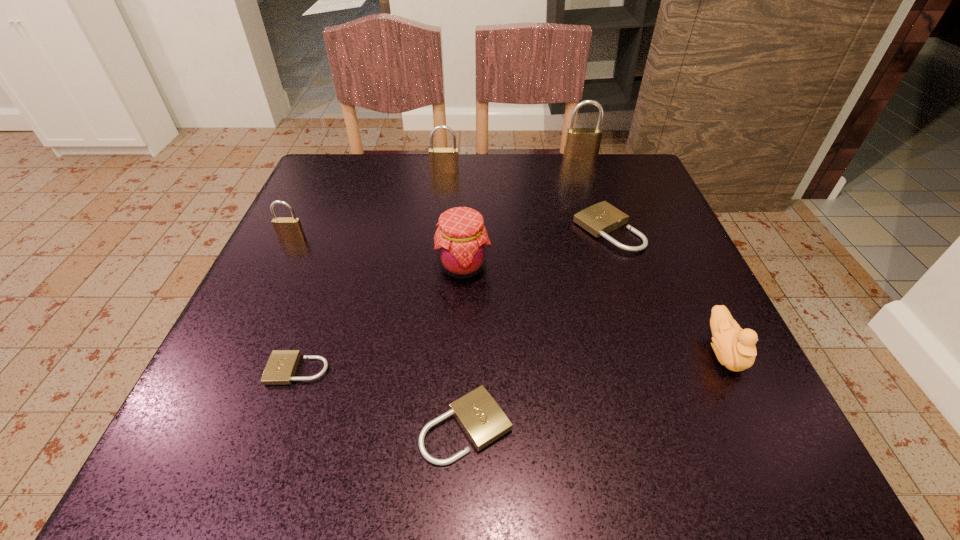
Image resolution: width=960 pixels, height=540 pixels. What are the coordinates of `the second smallest beige padlock` in the screenshot? It's located at (479, 415).

Where is `the nearest padlock`? The height and width of the screenshot is (540, 960). the nearest padlock is located at coordinates (479, 415).

You are a GUI agent. You are given a task and a screenshot of the screen. Output one action in this format:
    pyautogui.click(x=<x>, y=<y>)
    Task: Click on the second nearest padlock
    
    Given the screenshot: What is the action you would take?
    point(281,367)

This screenshot has width=960, height=540. In order to click on the shortest object in this screenshot , I will do `click(281, 367)`.

The image size is (960, 540). Identify the location of free spot located 0.320m on the front-facing side of the farthest padlock. (607, 238).

The image size is (960, 540). In order to click on vacant position located 0.150m on the front-facing side of the fifth shortest padlock in this screenshot , I will do `click(441, 210)`.

Image resolution: width=960 pixels, height=540 pixels. I want to click on blank space located 0.110m on the back of the red jam, so click(x=466, y=215).

This screenshot has width=960, height=540. Identify the location of vacant space situated 0.050m on the front-facing side of the leftmost padlock. (282, 256).

Where is `free spot located 0.160m on the back of the third shortest object`? free spot located 0.160m on the back of the third shortest object is located at coordinates (588, 171).

This screenshot has width=960, height=540. I want to click on vacant space situated on the right of the nearest beige padlock, so click(x=585, y=427).